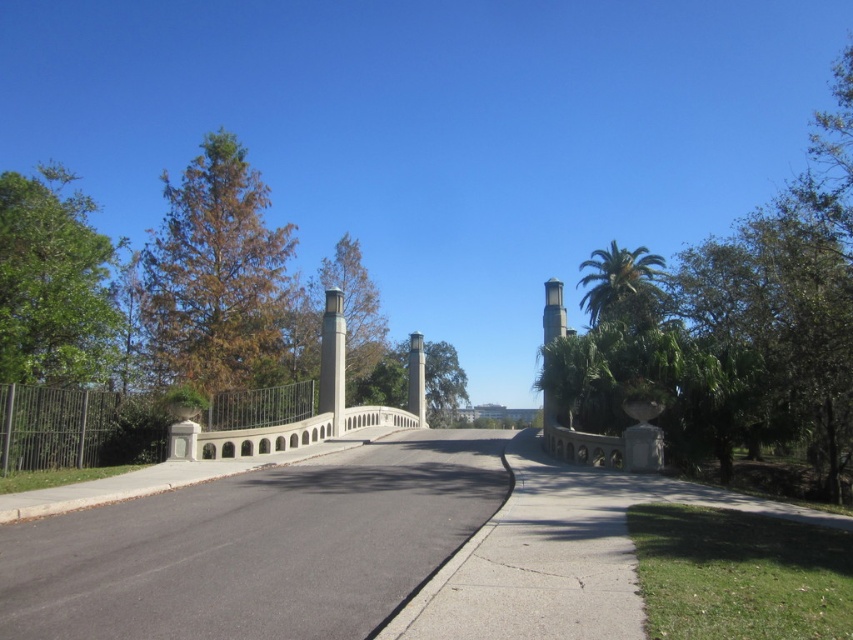
Question: Can you confirm if brown/dried leaves tree at left is smaller than white concrete pillar at center?

Choices:
 (A) no
 (B) yes

Answer: (A)

Question: Among these points, which one is nearest to the camera?

Choices:
 (A) (432, 570)
 (B) (408, 401)
 (C) (231, 353)

Answer: (A)

Question: Which object is the closest to the green matte tree at center?

Choices:
 (A) green leafy tree at left
 (B) green leafy palm tree at upper right
 (C) black asphalt driveway at center
 (D) white stone pillar at center

Answer: (D)

Question: Can you confirm if green leafy palm tree at upper right is thinner than white stone pillar at center?

Choices:
 (A) no
 (B) yes

Answer: (A)

Question: Is black asphalt driveway at center further to camera compared to green matte tree at center?

Choices:
 (A) yes
 (B) no

Answer: (B)

Question: Estimate the real-world distances between objects in this image. Which object is farther from the brown/dried leaves tree at left?

Choices:
 (A) green matte tree at center
 (B) white stone pillar at center
 (C) green leafy palm tree at upper right

Answer: (C)